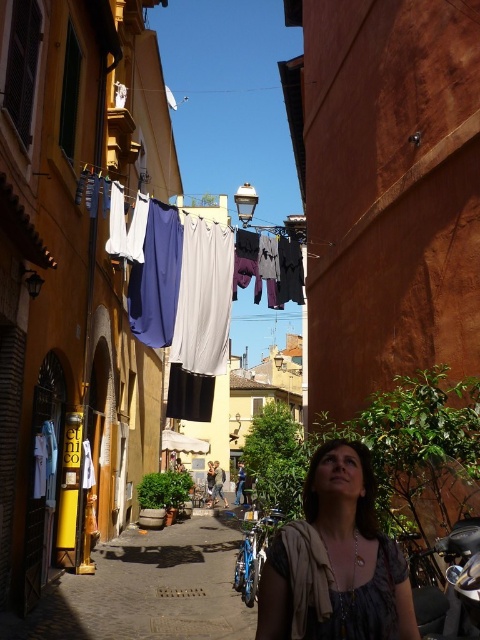
Question: Can you confirm if matte gray blouse at center is wider than matte white fabric at center?

Choices:
 (A) yes
 (B) no

Answer: (B)

Question: Does matte gray blouse at center have a larger size compared to matte white fabric at center?

Choices:
 (A) yes
 (B) no

Answer: (B)

Question: Is the position of matte gray blouse at center less distant than that of matte white fabric at center?

Choices:
 (A) no
 (B) yes

Answer: (B)